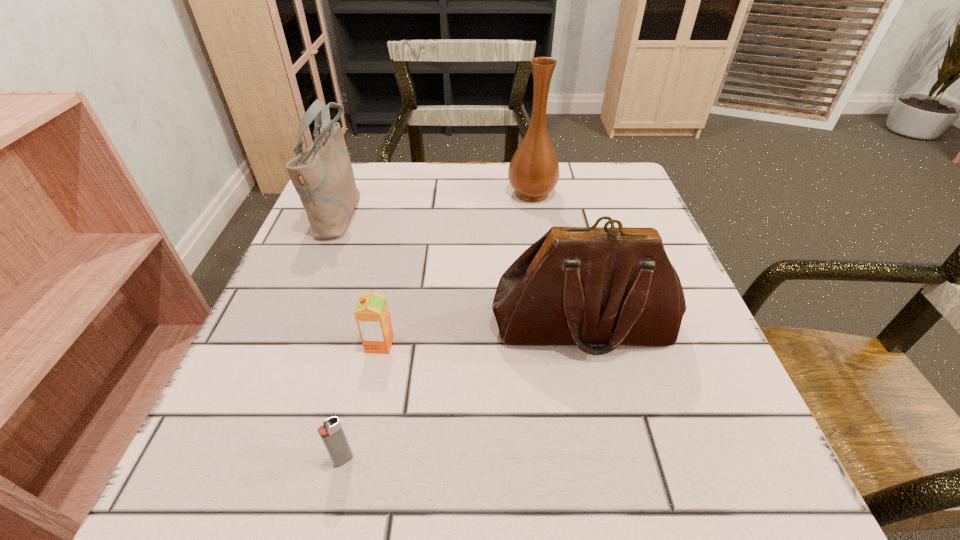
At what (x,y) coordinates should I click in order to perform the action: click on vacant space at the right edge. Please return your answer as a coordinate pair (x, y). Looking at the image, I should click on (644, 375).

I want to click on vacant space at the far right corner of the desktop, so click(610, 176).

Image resolution: width=960 pixels, height=540 pixels. In order to click on free spot between the orange juice and the vase in this screenshot , I will do `click(456, 269)`.

Identify the location of free space between the igniter and the vase. The width and height of the screenshot is (960, 540). pos(438,327).

Where is `empty space between the right shoulder bag and the orange juice`? empty space between the right shoulder bag and the orange juice is located at coordinates (482, 335).

At what (x,y) coordinates should I click in order to perform the action: click on empty space that is in between the vase and the nearest object. Please return your answer as a coordinate pair (x, y). Looking at the image, I should click on (438, 327).

I want to click on free spot between the orange juice and the nearer shoulder bag, so click(x=482, y=335).

Locate an element on the screen. vacant space in between the vase and the shortest object is located at coordinates (438, 327).

Where is `vacant region between the igniter and the nearer shoulder bag`? The image size is (960, 540). vacant region between the igniter and the nearer shoulder bag is located at coordinates (464, 393).

This screenshot has width=960, height=540. What are the coordinates of `empty location between the orange juice and the right shoulder bag` in the screenshot? It's located at (482, 335).